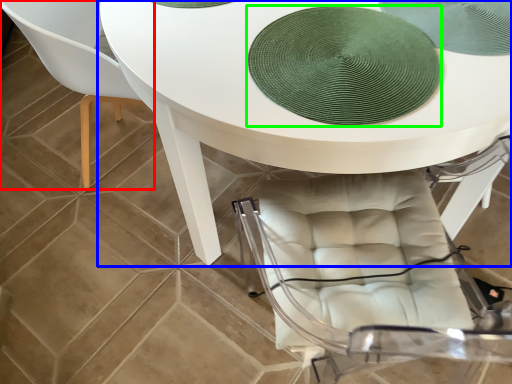
Question: Which object is positioned farthest from chair (highlighted by a red box)? Select from table (highlighted by a blue box) and mat (highlighted by a green box).

Choices:
 (A) table
 (B) mat

Answer: (B)